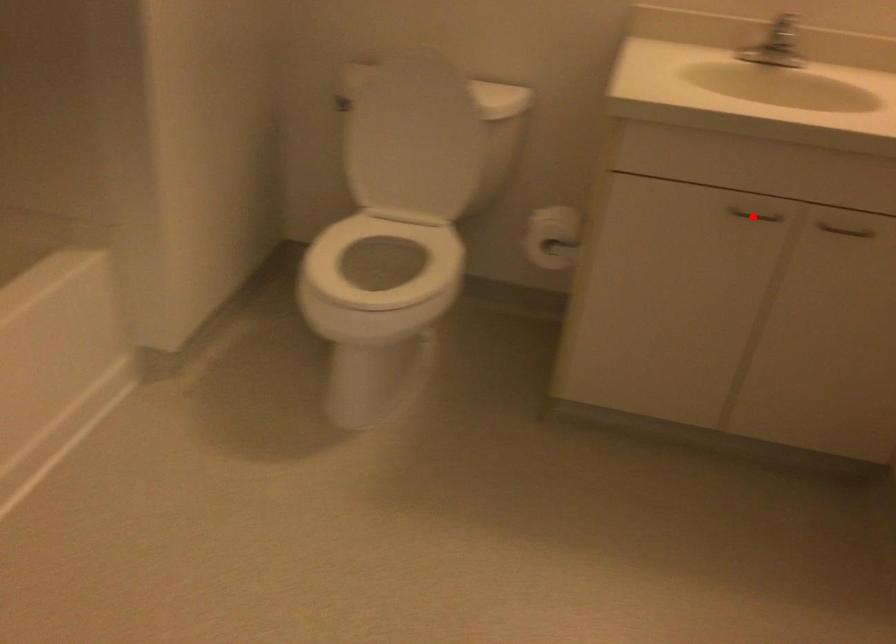
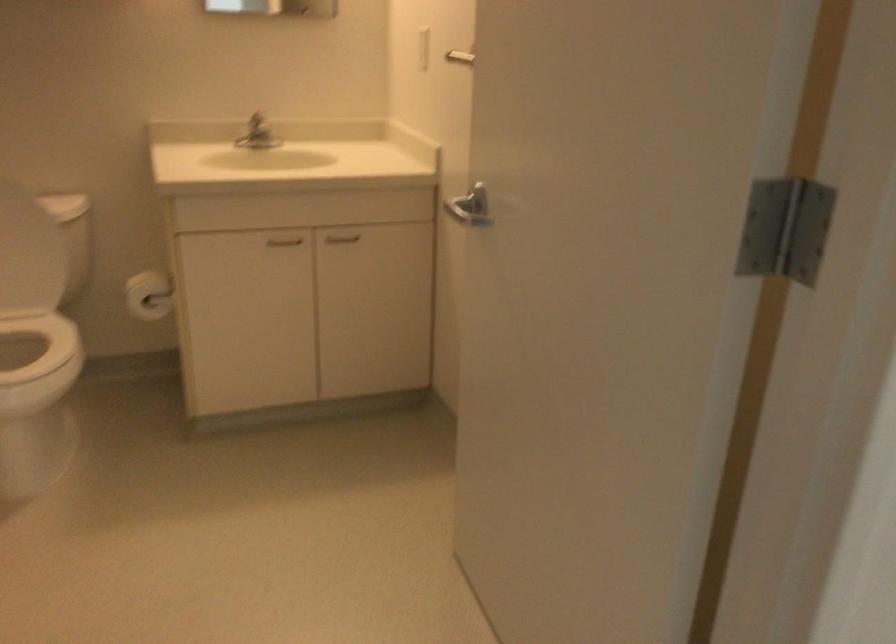
Find the pixel in the second image that matches the highlighted location in the first image.

(283, 241)